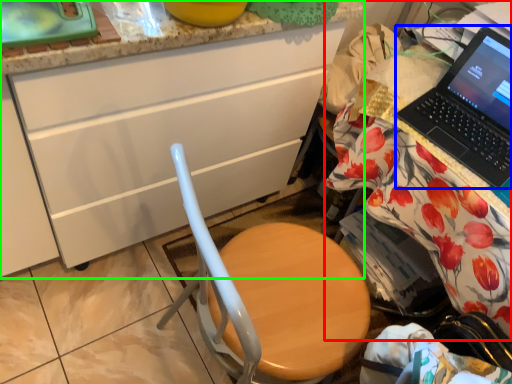
Question: Which object is positioned closest to desk (highlighted by a red box)? Select from laptop (highlighted by a blue box) and cabinetry (highlighted by a green box).

Choices:
 (A) laptop
 (B) cabinetry

Answer: (A)